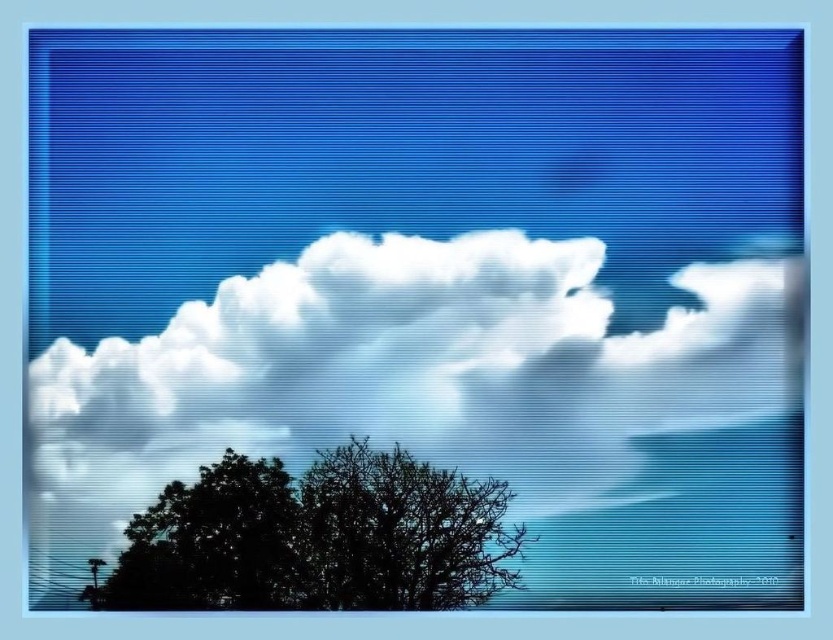
Can you confirm if silhouette leafy tree at lower center is positioned to the left of silhouette leafy tree at lower left?

Incorrect, silhouette leafy tree at lower center is not on the left side of silhouette leafy tree at lower left.

Measure the distance from silhouette leafy tree at lower center to silhouette leafy tree at lower left.

silhouette leafy tree at lower center and silhouette leafy tree at lower left are 1.92 inches apart from each other.

Which is in front, point (228, 472) or point (166, 548)?

Positioned in front is point (166, 548).

Find the location of a particular element. silhouette leafy tree at lower center is located at coordinates (317, 538).

Does white fluffy cloud at upper center have a larger size compared to silhouette leafy tree at lower left?

Indeed, white fluffy cloud at upper center has a larger size compared to silhouette leafy tree at lower left.

Does white fluffy cloud at upper center have a lesser width compared to silhouette leafy tree at lower left?

Incorrect, white fluffy cloud at upper center's width is not less than silhouette leafy tree at lower left's.

Between point (580, 404) and point (278, 483), which one is positioned behind?

Point (580, 404)

Where is `white fluffy cloud at upper center`? The width and height of the screenshot is (833, 640). white fluffy cloud at upper center is located at coordinates (405, 378).

Measure the distance between white fluffy cloud at upper center and silhouette leafy tree at lower center.

A distance of 7.69 inches exists between white fluffy cloud at upper center and silhouette leafy tree at lower center.

At what (x,y) coordinates should I click in order to perform the action: click on white fluffy cloud at upper center. Please return your answer as a coordinate pair (x, y). This screenshot has width=833, height=640. Looking at the image, I should click on tap(405, 378).

At what (x,y) coordinates should I click in order to perform the action: click on white fluffy cloud at upper center. Please return your answer as a coordinate pair (x, y). The height and width of the screenshot is (640, 833). Looking at the image, I should click on (405, 378).